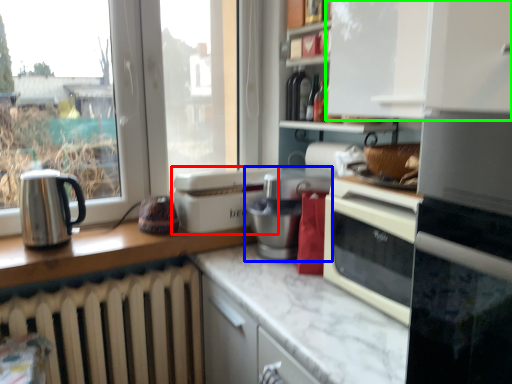
Question: Considering the real-world distances, which object is closest to kitchen appliance (highlighted by a red box)? appliance (highlighted by a blue box) or cabinetry (highlighted by a green box).

Choices:
 (A) appliance
 (B) cabinetry

Answer: (A)